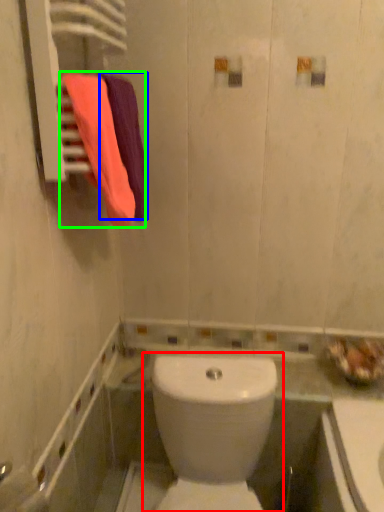
Question: Considering the real-world distances, which object is farthest from toilet (highlighted by a red box)? bath towel (highlighted by a blue box) or bath towel (highlighted by a green box)?

Choices:
 (A) bath towel
 (B) bath towel

Answer: (A)